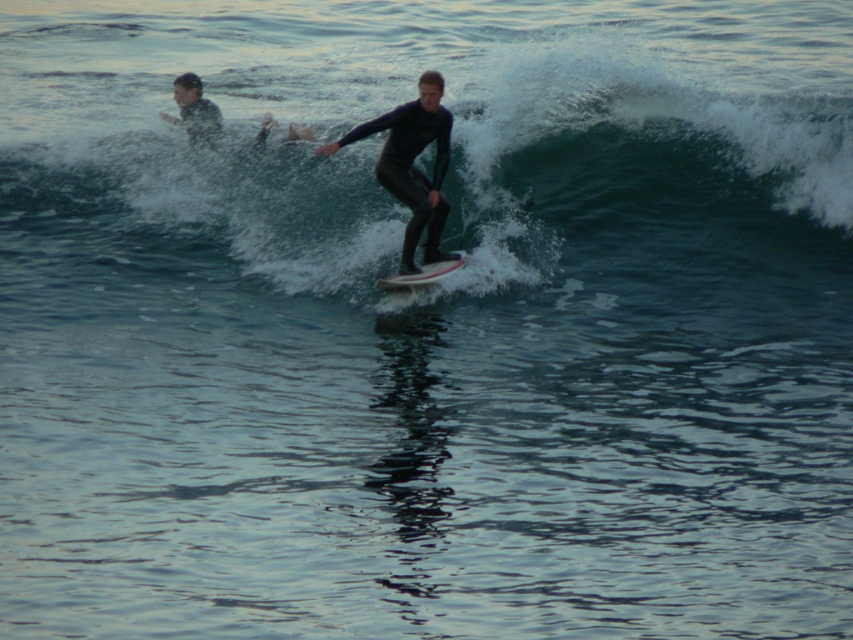
You are a lifeguard on duty and see two surfers in the water. The first surfer is at point (405,204). The second surfer is at point 0.680, 0.583. How far apart are the two surfers?

The two surfers are 28.11 meters apart.

You are a photographer trying to capture the black matte surfboard at center. Based on the scene description, what are the coordinates where you should focus your camera?

The black matte surfboard at center is located at coordinates point (412,164).

You are a surfer trying to catch a wave. You see a green rubber wave at upper center and a black matte surfboard at center. How far apart are these two objects?

The green rubber wave at upper center and the black matte surfboard at center are 5.77 meters apart from each other.